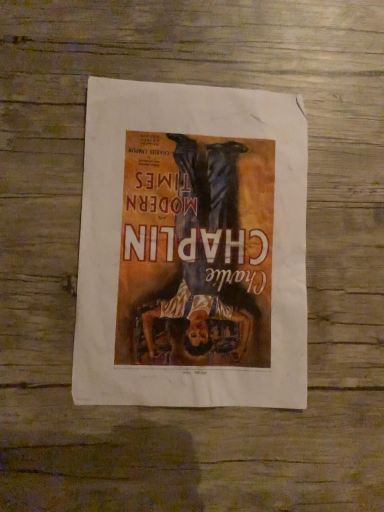
Where is `free spot above matte paper poster at center (from a real-world perspective)`? This screenshot has width=384, height=512. free spot above matte paper poster at center (from a real-world perspective) is located at coordinates (199, 239).